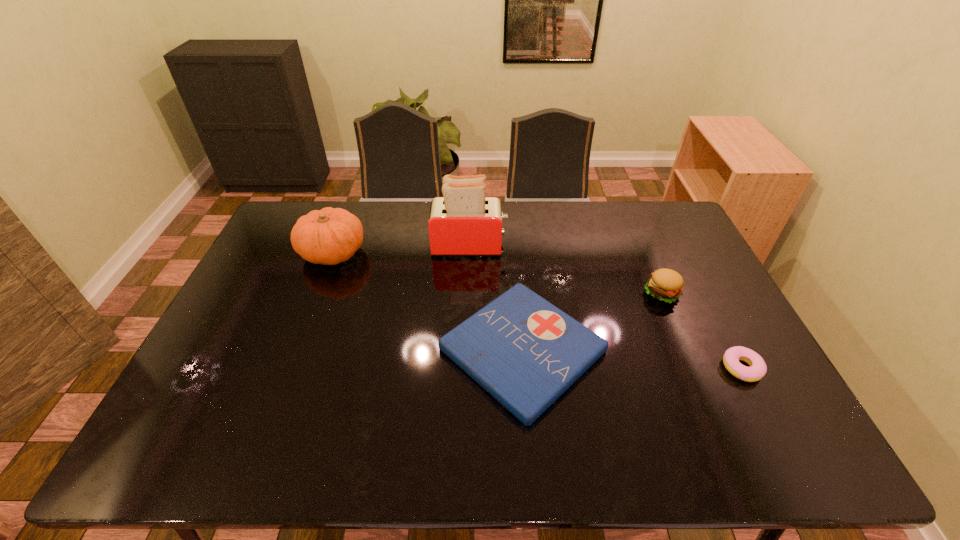
Identify the location of free space between the tallest object and the first-aid kit. This screenshot has width=960, height=540. (496, 298).

Where is `free spot between the first-aid kit and the third shortest object`? This screenshot has height=540, width=960. free spot between the first-aid kit and the third shortest object is located at coordinates (591, 321).

The image size is (960, 540). Find the location of `free space between the second object from right to left and the doughnut`. free space between the second object from right to left and the doughnut is located at coordinates (702, 330).

This screenshot has width=960, height=540. Find the location of `the closest object to the first-aid kit`. the closest object to the first-aid kit is located at coordinates (666, 285).

The image size is (960, 540). I want to click on the closest object to the first-aid kit, so click(666, 285).

At what (x,y) coordinates should I click in order to perform the action: click on free space that satisfies the following two spatial constraints: 1. on the front-facing side of the toaster; 2. on the left side of the rightmost object. Please return your answer as a coordinate pair (x, y). Looking at the image, I should click on (466, 368).

Find the location of a particular element. Image resolution: width=960 pixels, height=540 pixels. free region that satisfies the following two spatial constraints: 1. on the front-facing side of the doughnut; 2. on the left side of the toaster is located at coordinates (466, 368).

This screenshot has width=960, height=540. In order to click on free point that satisfies the following two spatial constraints: 1. on the front side of the rightmost object; 2. on the left side of the hamburger in this screenshot , I will do `click(693, 368)`.

Identify the location of vacant space that satisfies the following two spatial constraints: 1. on the back side of the first-aid kit; 2. on the front-facing side of the tallest object. (514, 246).